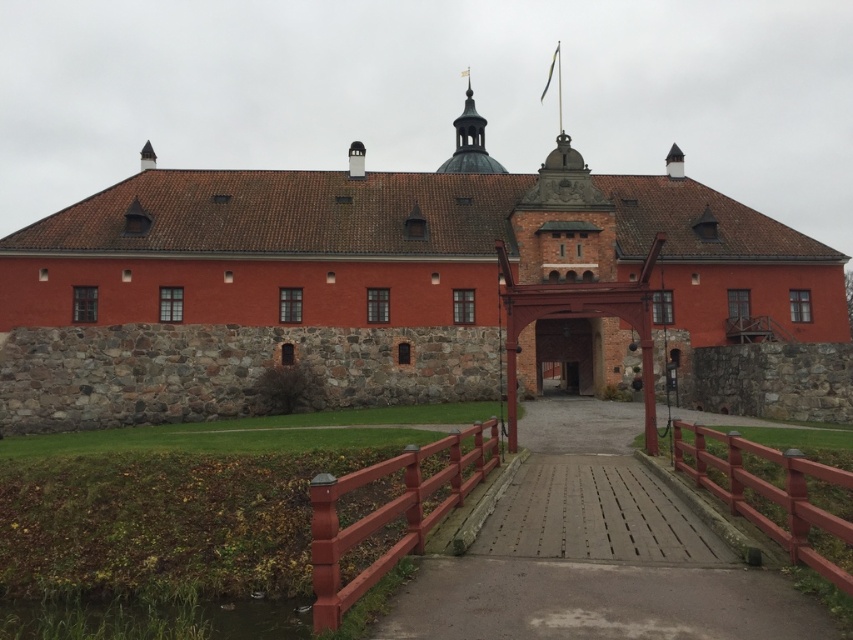
Is red brick castle at center smaller than brown wooden gate at center?

No, red brick castle at center is not smaller than brown wooden gate at center.

Is red brick castle at center above brown wooden gate at center?

Correct, red brick castle at center is located above brown wooden gate at center.

Between point (688, 248) and point (567, 378), which one is positioned behind?

The point (567, 378) is behind.

Find the location of `red brick castle at center`. red brick castle at center is located at coordinates (413, 248).